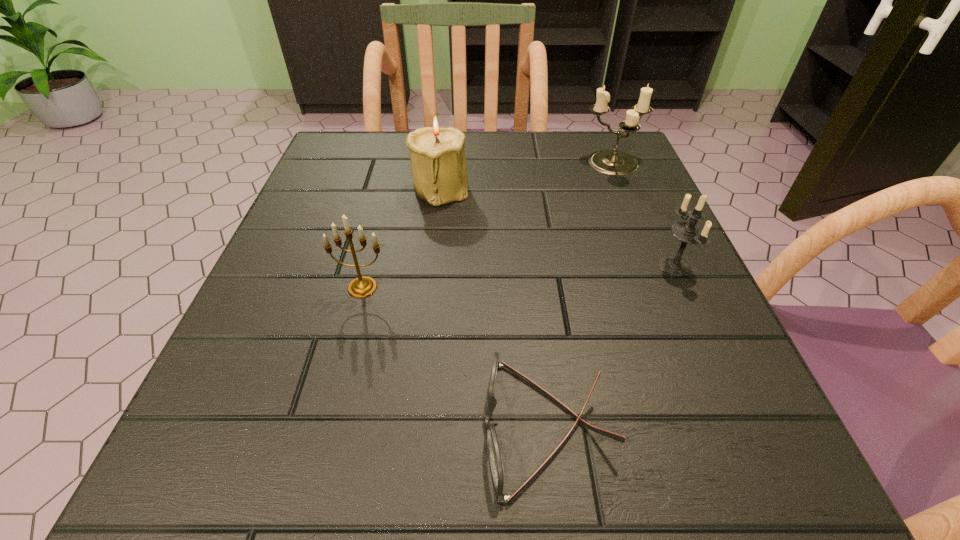
Locate an element on the screen. the third candle holder from right to left is located at coordinates (438, 161).

You are a GUI agent. You are given a task and a screenshot of the screen. Output one action in this format:
    pyautogui.click(x=<x>, y=<y>)
    Task: Click on the leftmost candle holder
    The height and width of the screenshot is (540, 960).
    Given the screenshot: What is the action you would take?
    pyautogui.click(x=363, y=286)

Find the location of a particular element. the shortest object is located at coordinates (496, 465).

Identify the location of the nearest object. (496, 465).

The width and height of the screenshot is (960, 540). I want to click on vacant space located on the back of the second object from left to right, so click(x=444, y=149).

Identify the location of vacant space located 0.300m on the back of the leftmost candle holder. The height and width of the screenshot is (540, 960). (392, 177).

Locate an element on the screen. The height and width of the screenshot is (540, 960). free space located on the front-facing side of the third object from left to right is located at coordinates (361, 427).

You are a GUI agent. You are given a task and a screenshot of the screen. Output one action in this format:
    pyautogui.click(x=<x>, y=<y>)
    Task: Click on the vacant space located 0.200m on the front-facing side of the third object from left to right
    
    Given the screenshot: What is the action you would take?
    pyautogui.click(x=320, y=427)

You are a GUI agent. You are given a task and a screenshot of the screen. Output one action in this format:
    pyautogui.click(x=<x>, y=<y>)
    Task: Click on the vacant area situated on the front-facing side of the third object from left to right
    Image resolution: width=960 pixels, height=540 pixels.
    Given the screenshot: What is the action you would take?
    pyautogui.click(x=410, y=427)

Locate an element on the screen. object positioned at the near edge is located at coordinates (496, 465).